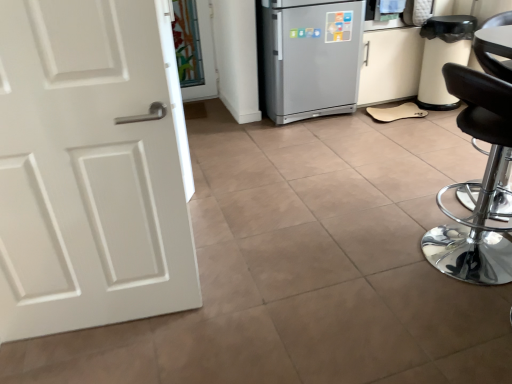
Question: Does silver metallic refrigerator at center have a lesser height compared to black leather stool at right?

Choices:
 (A) no
 (B) yes

Answer: (B)

Question: Considering the relative sizes of silver metallic refrigerator at center and black leather stool at right in the image provided, is silver metallic refrigerator at center bigger than black leather stool at right?

Choices:
 (A) no
 (B) yes

Answer: (A)

Question: From a real-world perspective, is silver metallic refrigerator at center physically above black leather stool at right?

Choices:
 (A) yes
 (B) no

Answer: (A)

Question: From the image's perspective, is silver metallic refrigerator at center located beneath black leather stool at right?

Choices:
 (A) no
 (B) yes

Answer: (A)

Question: Is silver metallic refrigerator at center to the left of black leather stool at right from the viewer's perspective?

Choices:
 (A) yes
 (B) no

Answer: (A)

Question: Is the depth of silver metallic refrigerator at center less than that of black leather stool at right?

Choices:
 (A) yes
 (B) no

Answer: (B)

Question: Can you confirm if black leather stool at right is bigger than silver metallic refrigerator at center?

Choices:
 (A) yes
 (B) no

Answer: (A)

Question: Is black leather stool at right taller than silver metallic refrigerator at center?

Choices:
 (A) no
 (B) yes

Answer: (B)

Question: Is black leather stool at right to the right of silver metallic refrigerator at center from the viewer's perspective?

Choices:
 (A) no
 (B) yes

Answer: (B)

Question: Can you confirm if black leather stool at right is thinner than silver metallic refrigerator at center?

Choices:
 (A) no
 (B) yes

Answer: (A)

Question: Does black leather stool at right have a greater width compared to silver metallic refrigerator at center?

Choices:
 (A) yes
 (B) no

Answer: (A)

Question: Is black leather stool at right next to silver metallic refrigerator at center?

Choices:
 (A) no
 (B) yes

Answer: (A)

Question: From a real-world perspective, is white matte cabinet at right over transparent glass door at upper center?

Choices:
 (A) no
 (B) yes

Answer: (B)